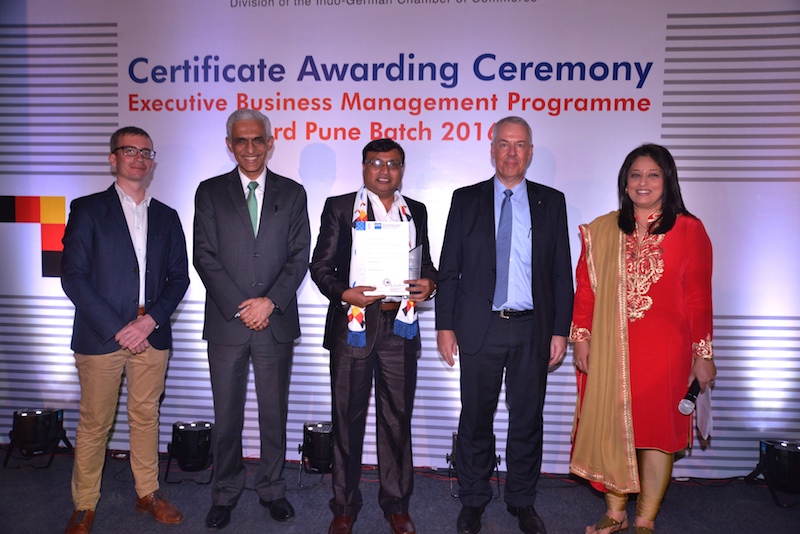
Identify the location of plaque. (418, 269).